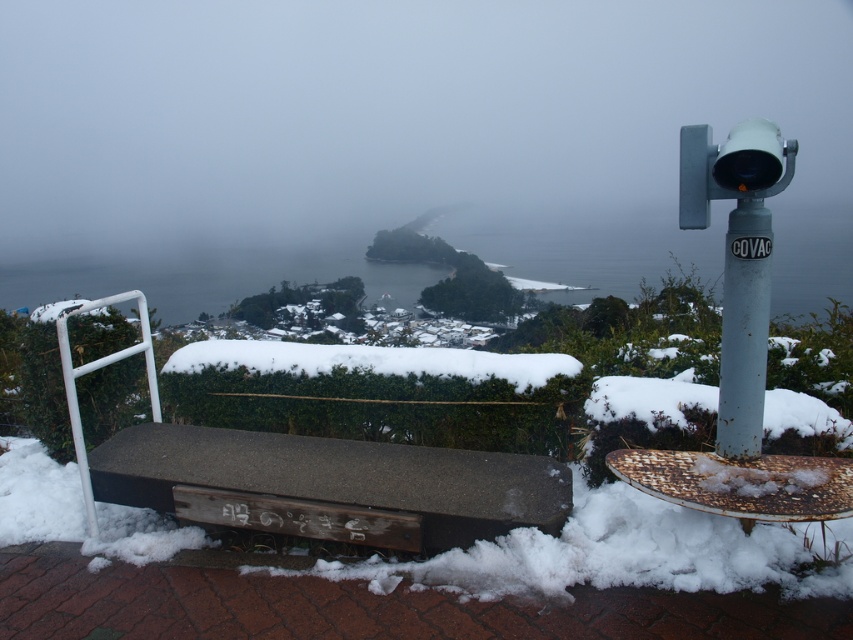
Does white fluffy hedge at center have a lesser width compared to rusty metal telescope at upper right?

Incorrect, white fluffy hedge at center's width is not less than rusty metal telescope at upper right's.

Is white fluffy hedge at center positioned before rusty metal telescope at upper right?

No.

This screenshot has height=640, width=853. Describe the element at coordinates (370, 362) in the screenshot. I see `white fluffy hedge at center` at that location.

This screenshot has height=640, width=853. Find the location of `white fluffy hedge at center`. white fluffy hedge at center is located at coordinates (370, 362).

Which is behind, point (456, 515) or point (753, 227)?

The point (456, 515) is more distant.

Which of these two, wooden bench at center or rusty metal telescope at upper right, stands shorter?

With less height is wooden bench at center.

The image size is (853, 640). What do you see at coordinates (329, 484) in the screenshot?
I see `wooden bench at center` at bounding box center [329, 484].

In order to click on wooden bench at center in this screenshot , I will do `click(329, 484)`.

Does wooden bench at center have a lesser height compared to white fluffy hedge at center?

Incorrect, wooden bench at center's height does not fall short of white fluffy hedge at center's.

Which is above, wooden bench at center or white fluffy hedge at center?

white fluffy hedge at center is higher up.

Image resolution: width=853 pixels, height=640 pixels. I want to click on wooden bench at center, so click(x=329, y=484).

Image resolution: width=853 pixels, height=640 pixels. Find the location of `wooden bench at center`. wooden bench at center is located at coordinates (329, 484).